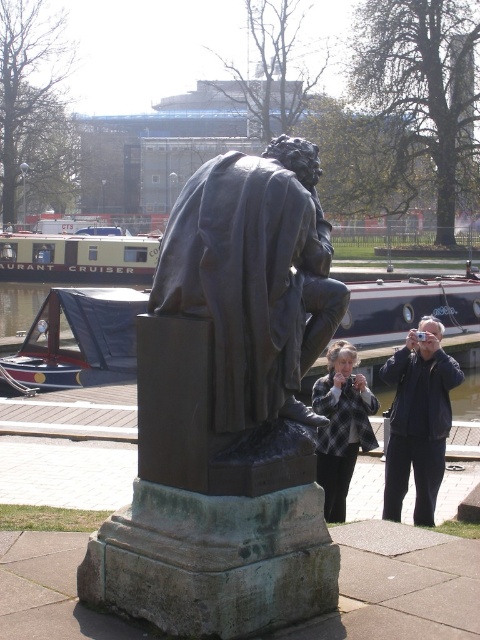
Question: Is dark blue jacket at center smaller than greenish-gray metal canal cruiser at center-left?

Choices:
 (A) yes
 (B) no

Answer: (A)

Question: Based on their relative distances, which object is nearer to the bronze statue at center?

Choices:
 (A) dark blue jacket at center
 (B) blue canvas boat at center

Answer: (A)

Question: Which object appears closest to the camera in this image?

Choices:
 (A) greenish-gray metal canal cruiser at center-left
 (B) dark blue jacket at center

Answer: (B)

Question: Is greenish-gray metal canal cruiser at center-left smaller than plaid fabric jacket at center?

Choices:
 (A) no
 (B) yes

Answer: (A)

Question: Can you confirm if blue canvas boat at center is positioned to the right of greenish-gray metal canal cruiser at center-left?

Choices:
 (A) no
 (B) yes

Answer: (B)

Question: Which is nearer to the bronze statue at center?

Choices:
 (A) plaid fabric jacket at center
 (B) blue canvas boat at center
 (C) greenish-gray metal canal cruiser at center-left

Answer: (A)